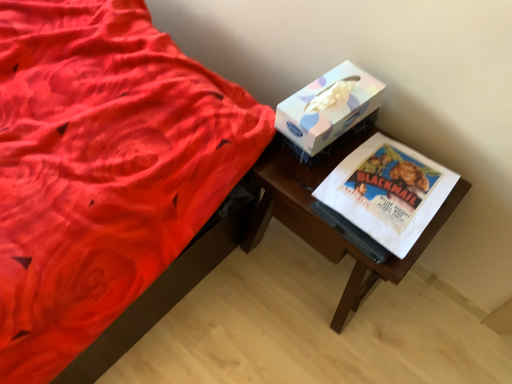
This screenshot has width=512, height=384. I want to click on free space to the right of wooden table at right, so click(432, 324).